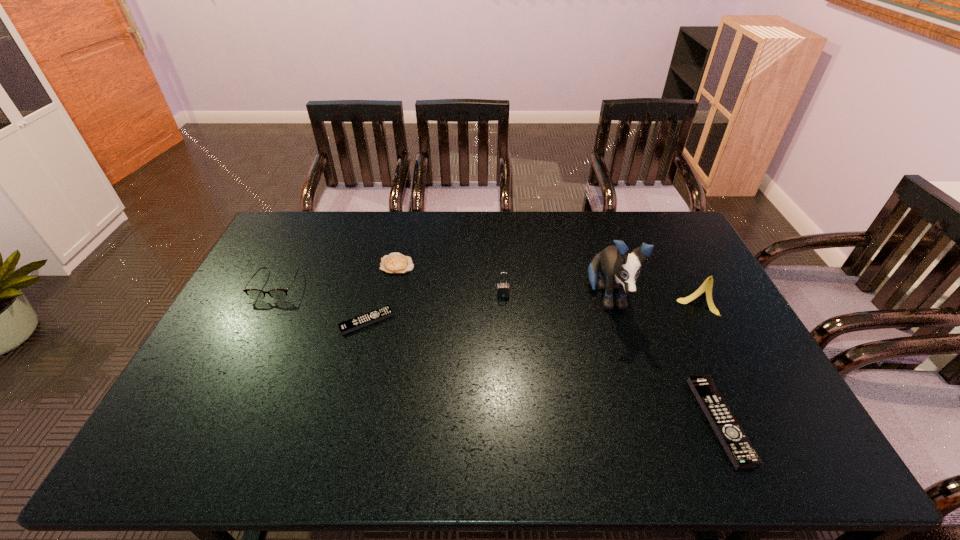
Locate an element on the screen. the sixth closest object to the quiche is located at coordinates (739, 449).

This screenshot has width=960, height=540. In order to click on vacant space that satisfies the following two spatial constraints: 1. on the face of the fourth tallest object; 2. on the left side of the fifth tallest object in this screenshot , I will do `click(209, 421)`.

Where is `free spot that satisfies the following two spatial constraints: 1. on the front side of the banana; 2. on the right side of the quiche`? The width and height of the screenshot is (960, 540). free spot that satisfies the following two spatial constraints: 1. on the front side of the banana; 2. on the right side of the quiche is located at coordinates (390, 299).